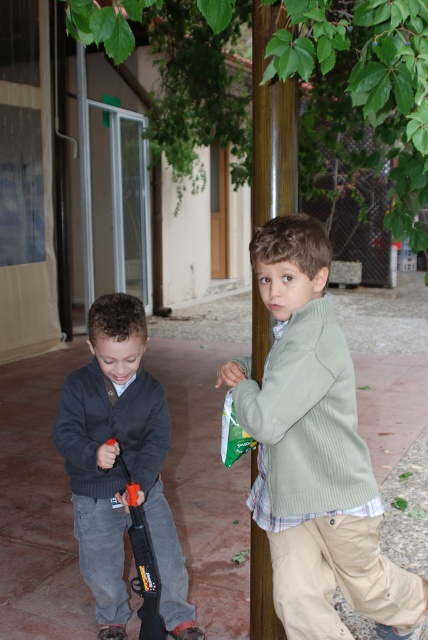
You are a delivery robot with a width of 18 inches. You need to pass between the light green sweater at center and the brown wooden pole at center. Can you fit through the space between them?

The distance between the light green sweater at center and the brown wooden pole at center is 19.91 inches. Since the robot is 18 inches wide, it can fit through the space as there is enough clearance.

You are standing in the scene and want to place a small flag exactly halfway between point (285,394) and point (155,564). Which direction should you move from the midpoint to ensure the flag is closer to the point that is nearer to you?

You should move the flag towards point (285,394) because it is closer to the viewer than point (155,564).

You are a tailor trying to determine if a light green sweater at center can be folded and placed into an orange plastic gun at left. Based on their sizes, is this feasible?

The light green sweater at center might be wider than orange plastic gun at left, so it is unlikely that the sweater can be folded and placed into the gun due to the size difference.